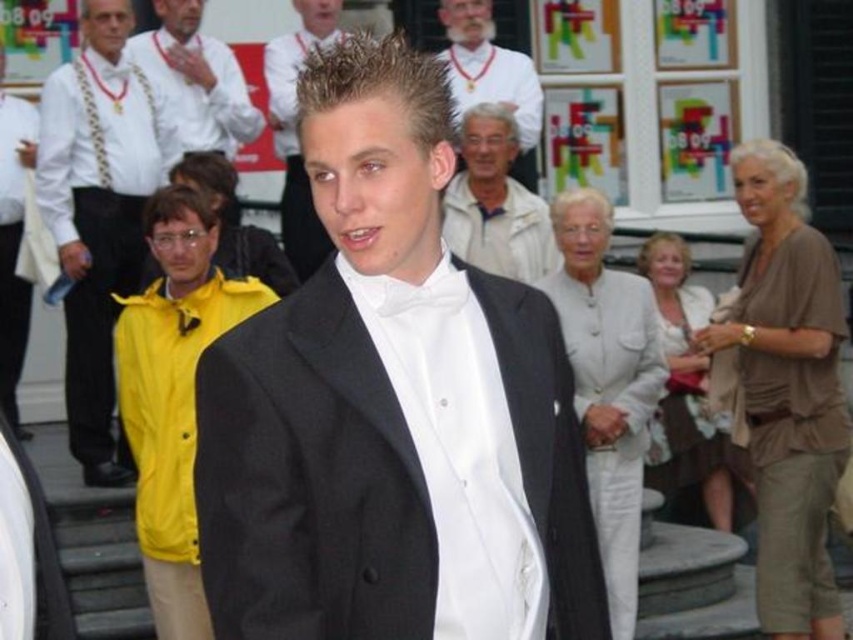
This screenshot has width=853, height=640. What do you see at coordinates (495, 202) in the screenshot?
I see `light beige cotton shirt at center` at bounding box center [495, 202].

Is point (506, 198) farther from viewer compared to point (15, 173)?

Yes, point (506, 198) is behind point (15, 173).

Image resolution: width=853 pixels, height=640 pixels. Identify the location of light beige cotton shirt at center. (495, 202).

At what (x,y) coordinates should I click in order to perform the action: click on light beige cotton shirt at center. Please return your answer as a coordinate pair (x, y). This screenshot has width=853, height=640. Looking at the image, I should click on (495, 202).

Does light beige cotton shirt at center have a lesser height compared to white satin dress at center?

No, light beige cotton shirt at center is not shorter than white satin dress at center.

Measure the distance between point (x=485, y=236) and camera.

A distance of 112.30 feet exists between point (x=485, y=236) and camera.

This screenshot has width=853, height=640. What are the coordinates of `light beige cotton shirt at center` in the screenshot? It's located at (495, 202).

Does white textured bow tie at upper center have a greater width compared to yellow fabric jacket at center?

Yes.

Looking at this image, is white textured bow tie at upper center above yellow fabric jacket at center?

Yes, white textured bow tie at upper center is above yellow fabric jacket at center.

Between point (477, 13) and point (280, 280), which one is positioned behind?

The point (477, 13) is more distant.

You are a GUI agent. You are given a task and a screenshot of the screen. Output one action in this format:
    pyautogui.click(x=<x>, y=<y>)
    Task: Click on the white textured bow tie at upper center
    This screenshot has height=640, width=853.
    Given the screenshot: What is the action you would take?
    pyautogui.click(x=491, y=76)